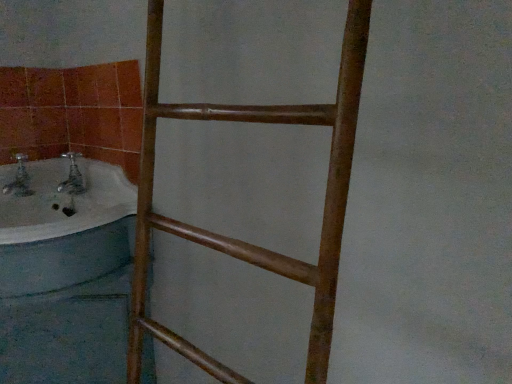
Question: Should I look upward or downward to see brown wooden ladder at center?

Choices:
 (A) down
 (B) up

Answer: (A)

Question: Is white glossy bathtub at left oriented towards brown wooden ladder at center?

Choices:
 (A) no
 (B) yes

Answer: (A)

Question: Is white glossy bathtub at left thinner than brown wooden ladder at center?

Choices:
 (A) yes
 (B) no

Answer: (B)

Question: Considering the relative positions of white glossy bathtub at left and brown wooden ladder at center in the image provided, is white glossy bathtub at left to the left of brown wooden ladder at center from the viewer's perspective?

Choices:
 (A) no
 (B) yes

Answer: (B)

Question: Is white glossy bathtub at left to the right of brown wooden ladder at center from the viewer's perspective?

Choices:
 (A) no
 (B) yes

Answer: (A)

Question: Is white glossy bathtub at left positioned beyond the bounds of brown wooden ladder at center?

Choices:
 (A) yes
 (B) no

Answer: (A)

Question: Would you say white glossy bathtub at left is a long distance from brown wooden ladder at center?

Choices:
 (A) no
 (B) yes

Answer: (A)

Question: From the image's perspective, would you say brown wooden ladder at center is shown under white glossy bathtub at left?

Choices:
 (A) no
 (B) yes

Answer: (B)

Question: Is white glossy bathtub at left a part of brown wooden ladder at center?

Choices:
 (A) yes
 (B) no

Answer: (B)

Question: Does brown wooden ladder at center turn towards white glossy bathtub at left?

Choices:
 (A) no
 (B) yes

Answer: (A)

Question: Is the depth of brown wooden ladder at center less than that of white glossy bathtub at left?

Choices:
 (A) yes
 (B) no

Answer: (A)

Question: Does brown wooden ladder at center have a lesser height compared to white glossy bathtub at left?

Choices:
 (A) no
 (B) yes

Answer: (A)

Question: Is brown wooden ladder at center turned away from white glossy bathtub at left?

Choices:
 (A) no
 (B) yes

Answer: (A)

Question: From a real-world perspective, relative to brown wooden ladder at center, is white glossy bathtub at left vertically above or below?

Choices:
 (A) above
 (B) below

Answer: (B)